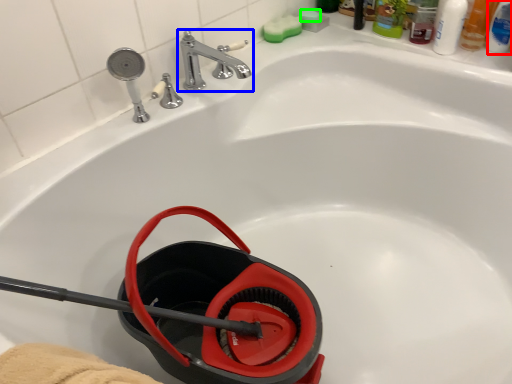
Question: Which object is positioned closest to mouthwash (highlighted by a red box)? Select from tap (highlighted by a blue box) and soap (highlighted by a green box).

Choices:
 (A) tap
 (B) soap

Answer: (B)